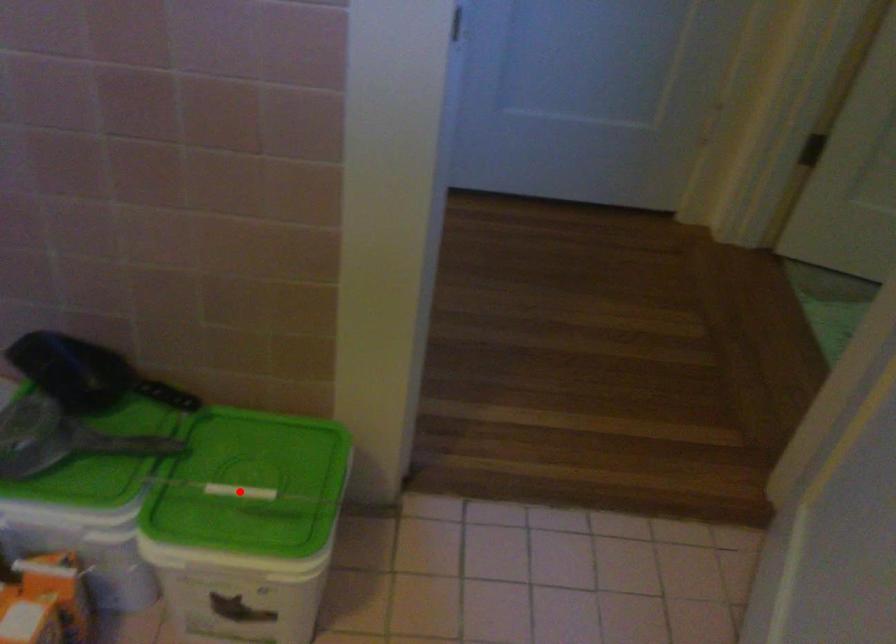
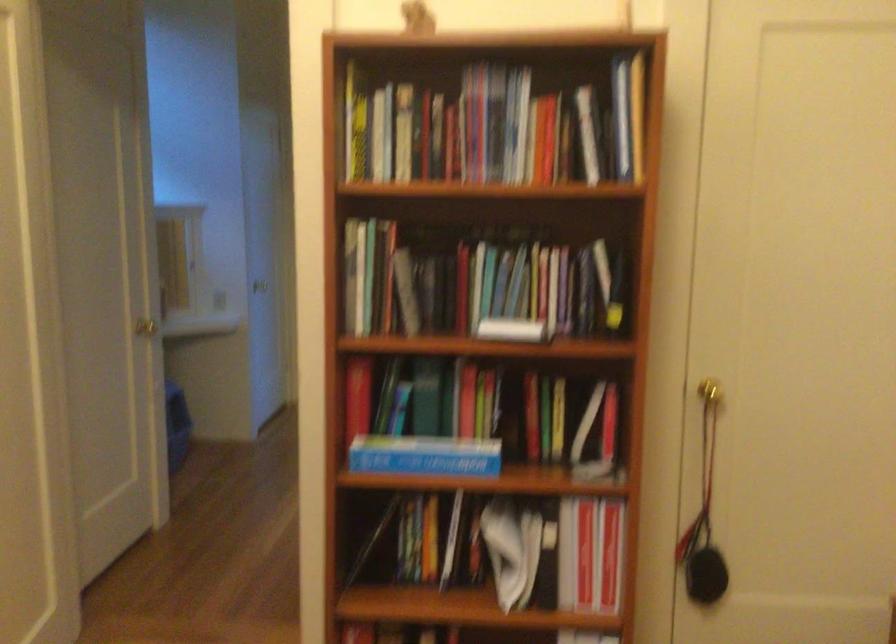
Question: I am providing you with two images of the same scene from different viewpoints. A red point is marked on the first image. Can you still see the location of the red point in image 2?

Choices:
 (A) Yes
 (B) No

Answer: (B)